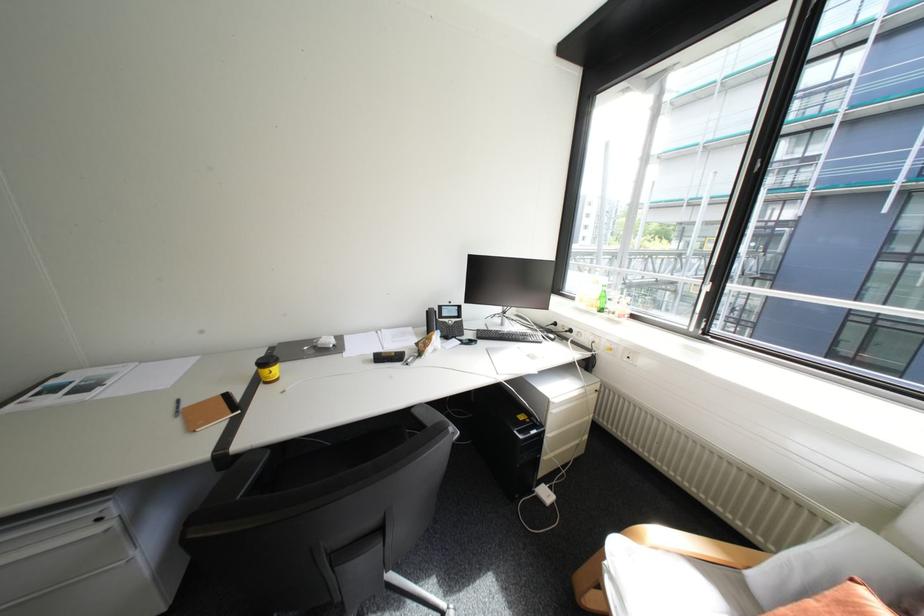
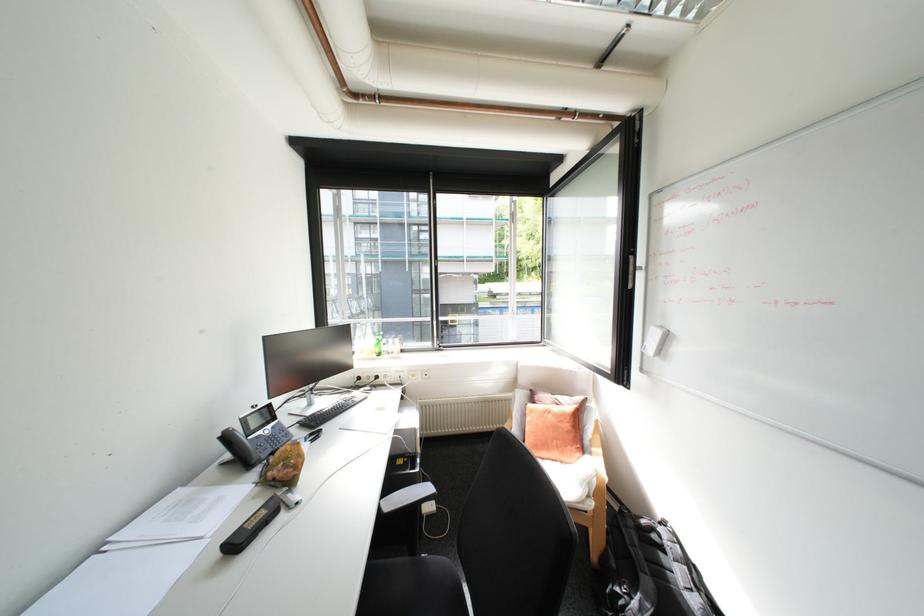
Question: The first image is from the beginning of the video and the second image is from the end. How did the camera likely rotate when shooting the video?

Choices:
 (A) Left
 (B) Right
 (C) Up
 (D) Down

Answer: (B)